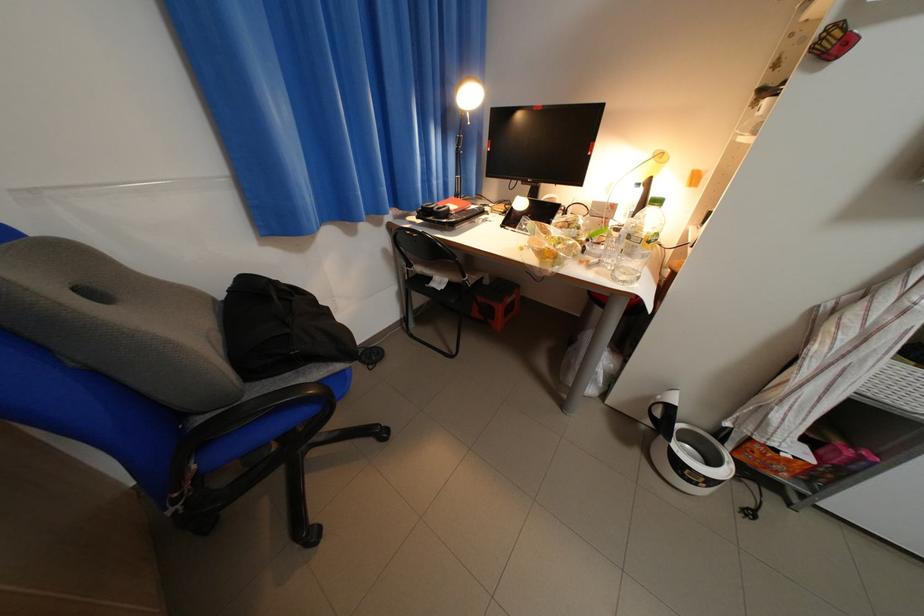
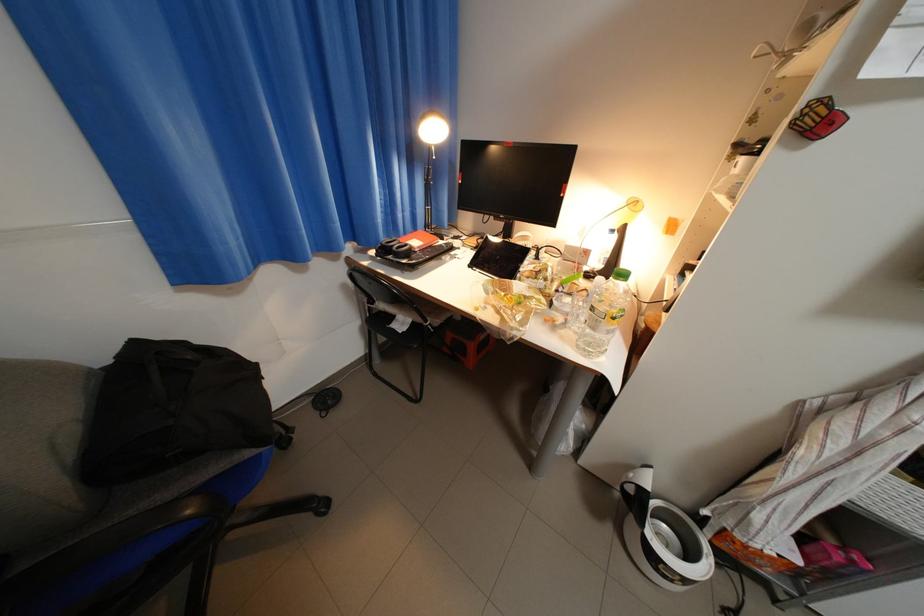
Locate, in the second image, the point that corresponds to pixel 499 177 in the first image.

(469, 209)